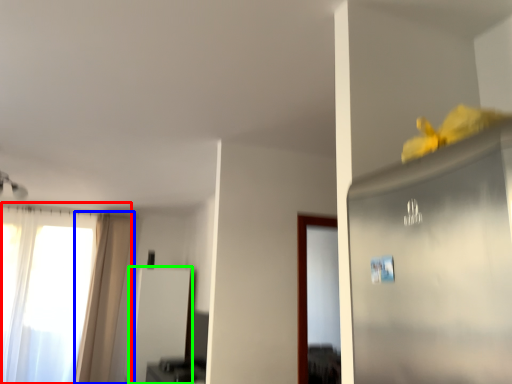
Question: Which object is the closest to the window (highlighted by a red box)? Choose among these: curtain (highlighted by a blue box) or screen door (highlighted by a green box).

Choices:
 (A) curtain
 (B) screen door

Answer: (A)